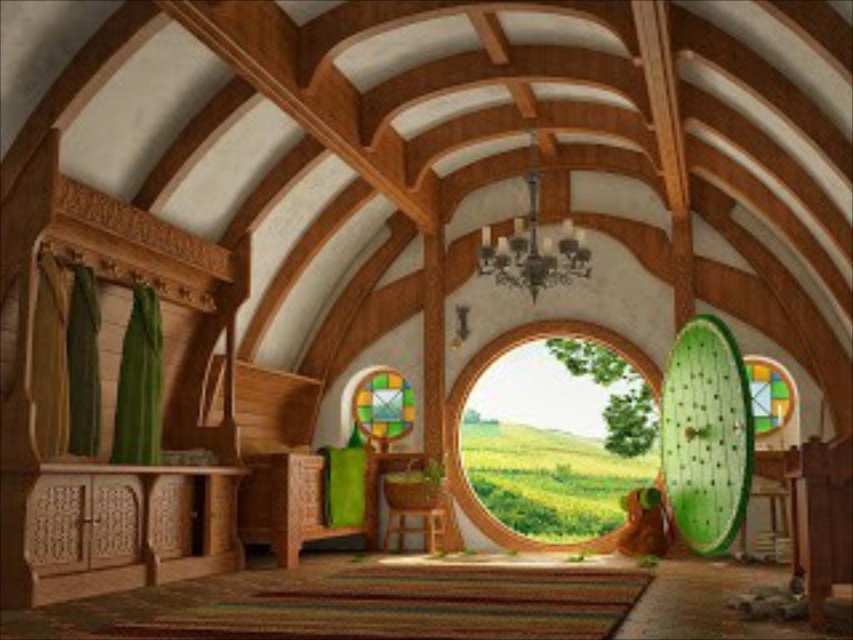
You are a visitor standing in the center of the hobbit house. You want to hang a painting that is 1.5 meters wide between the wooden circle at center and the metallic chandelier at center. Can you fit it there?

The distance between the wooden circle at center and the metallic chandelier at center is 1.85 meters. Since the painting is 1.5 meters wide, it can fit between them as there is enough space.

You are a guest visiting this hobbit house and want to know which object is taller between the wooden circle at center and the stained glass window at center. Can you tell me?

The wooden circle at center is much taller than the stained glass window at center.